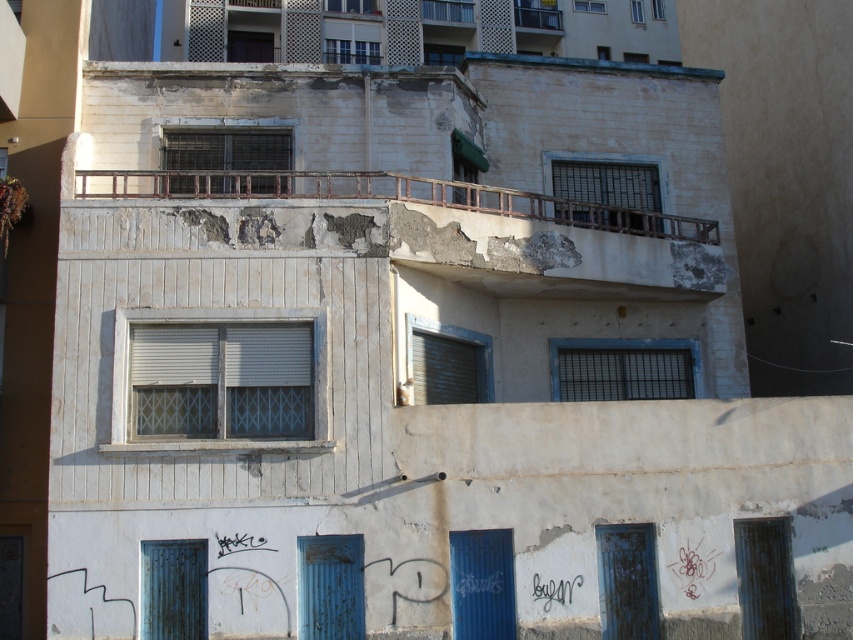
Question: Observing the image, what is the correct spatial positioning of metallic grid at upper center in reference to blue matte shutter at center?

Choices:
 (A) above
 (B) below

Answer: (A)

Question: Considering the relative positions of rusty metal railing at upper center and metallic grid at upper center in the image provided, where is rusty metal railing at upper center located with respect to metallic grid at upper center?

Choices:
 (A) right
 (B) left

Answer: (A)

Question: Which object is farther from the camera taking this photo?

Choices:
 (A) white matte shutter at center
 (B) matte metal shutter at center
 (C) blue matte shutter at center
 (D) blue painted metal shutter at lower center

Answer: (B)

Question: Which object is farther from the camera taking this photo?

Choices:
 (A) wooden at upper right
 (B) white matte shutter at center

Answer: (A)

Question: Which object is the farthest from the black metal grid at upper center?

Choices:
 (A) rusty metal shutter at lower center
 (B) rusty metal railing at upper center

Answer: (B)

Question: Can you confirm if metallic grid at upper center is positioned to the left of rusty metal door at lower left?

Choices:
 (A) yes
 (B) no

Answer: (A)